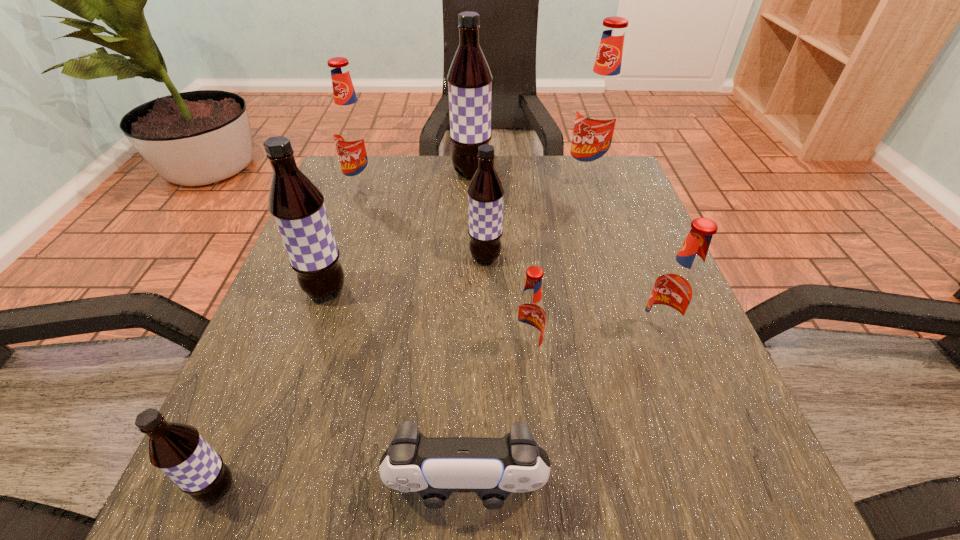
Identify the location of vacant space located on the right of the smallest brown root beer. The image size is (960, 540). (393, 489).

The width and height of the screenshot is (960, 540). I want to click on root beer that is at the near edge, so click(x=177, y=449).

Where is `control present at the near edge`? The width and height of the screenshot is (960, 540). control present at the near edge is located at coordinates (493, 468).

Find the location of a particular element. The height and width of the screenshot is (540, 960). object that is positioned at the far left corner is located at coordinates (352, 134).

Identify the location of object positioned at the near left corner. The height and width of the screenshot is (540, 960). (177, 449).

Where is `object that is at the far right corner`? The height and width of the screenshot is (540, 960). object that is at the far right corner is located at coordinates (598, 115).

The height and width of the screenshot is (540, 960). Identify the location of vacant space at the far edge of the desktop. (523, 160).

This screenshot has width=960, height=540. Identify the location of vacant space at the left edge. (238, 404).

Locate an element on the screen. Image resolution: width=960 pixels, height=540 pixels. free space at the right edge of the desktop is located at coordinates (644, 254).

This screenshot has width=960, height=540. I want to click on free location at the far right corner, so click(564, 177).